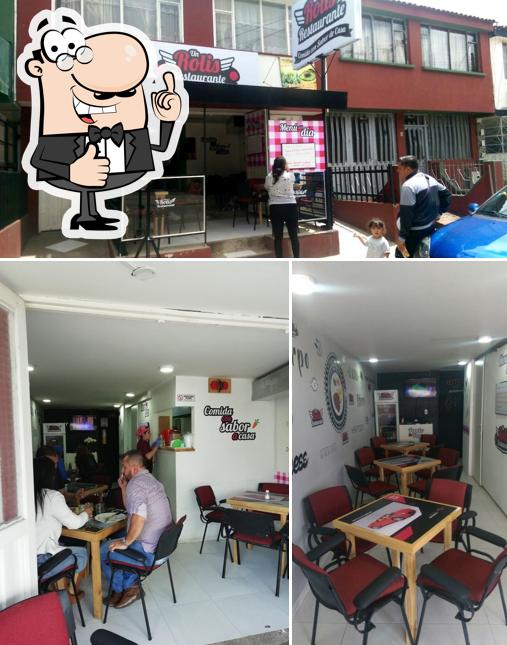
At what (x,y) coordinates should I click in order to perform the action: click on white wall. Please return your answer as a coordinate pair (x, y). This screenshot has height=645, width=507. Looking at the image, I should click on (232, 451).